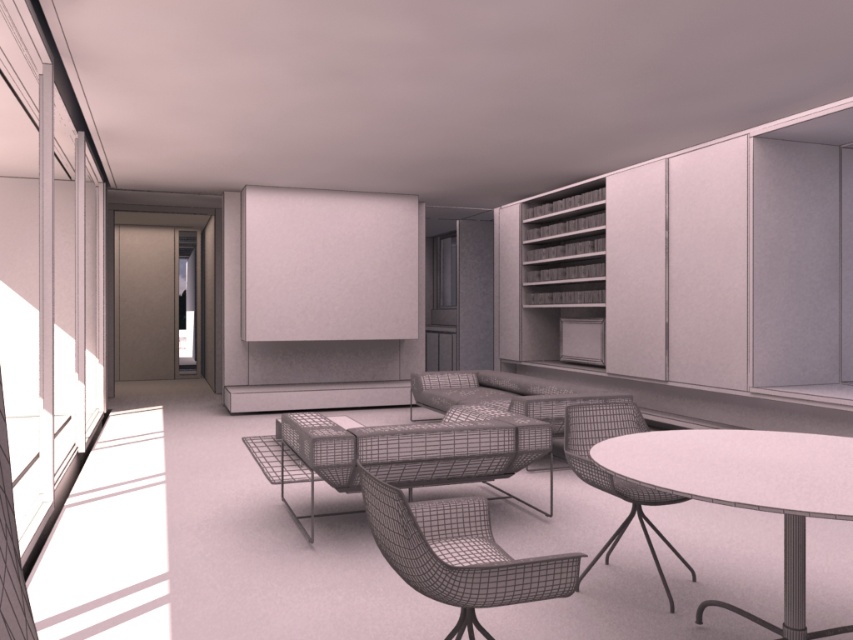
Is wireframe mesh chair at center below plaid fabric couch at center?

Yes, wireframe mesh chair at center is below plaid fabric couch at center.

Is wireframe mesh chair at center bigger than plaid fabric couch at center?

No.

Image resolution: width=853 pixels, height=640 pixels. Find the location of `wireframe mesh chair at center`. wireframe mesh chair at center is located at coordinates (457, 554).

Is white mesh table at center below plaid fabric couch at center?

Correct, white mesh table at center is located below plaid fabric couch at center.

Can you confirm if white mesh table at center is positioned to the left of plaid fabric couch at center?

No, white mesh table at center is not to the left of plaid fabric couch at center.

Who is more distant from viewer, (x=804, y=579) or (x=419, y=396)?

The point (x=419, y=396) is more distant.

I want to click on white mesh table at center, so coord(747,490).

Is white mesh table at center to the right of wireframe mesh armchair at lower right from the viewer's perspective?

Correct, you'll find white mesh table at center to the right of wireframe mesh armchair at lower right.

Is white mesh table at center above wireframe mesh armchair at lower right?

Yes, white mesh table at center is above wireframe mesh armchair at lower right.

Who is more distant from viewer, (722, 499) or (566, 426)?

The point (566, 426) is more distant.

Where is `white mesh table at center`? white mesh table at center is located at coordinates (747, 490).